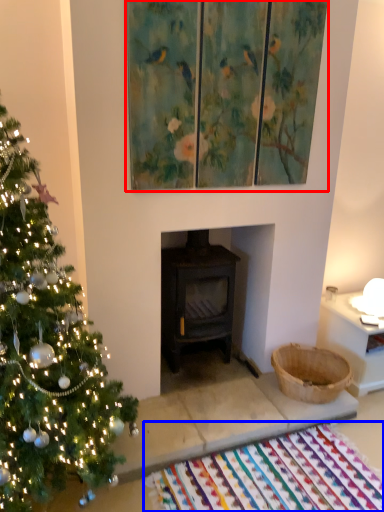
Question: Which object is closer to the camera taking this photo, picture frame (highlighted by a red box) or mat (highlighted by a blue box)?

Choices:
 (A) picture frame
 (B) mat

Answer: (B)